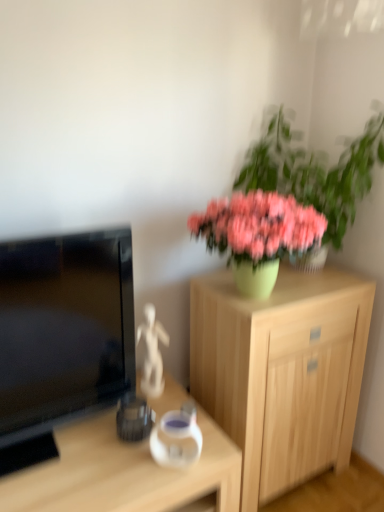
Image resolution: width=384 pixels, height=512 pixels. Find the location of `vacant space to the left of transparent glass vase at center`. vacant space to the left of transparent glass vase at center is located at coordinates (120, 467).